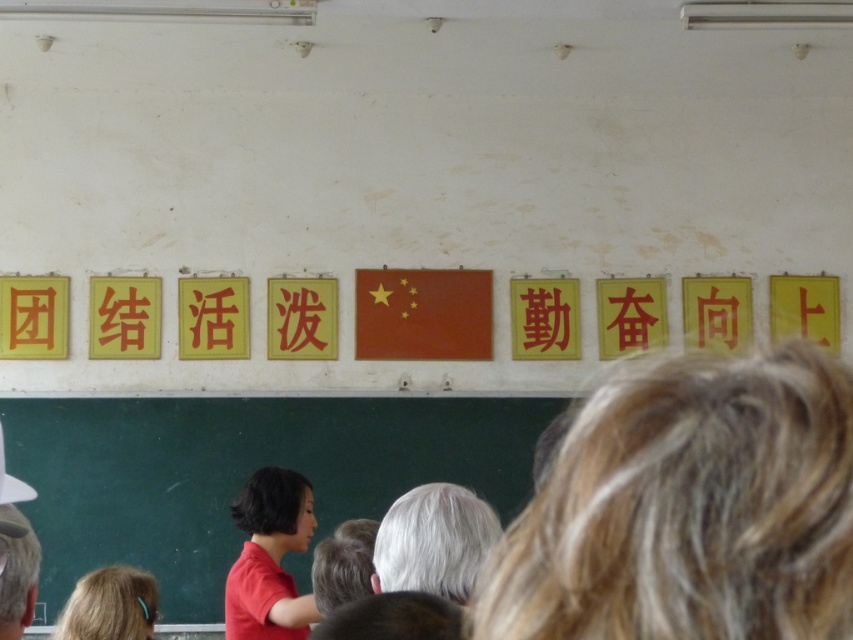
You are a photographer trying to capture a group photo of two people with different hair colors. You see a person with gray hair at center and another with blonde hair at lower left. Which person should you focus on first if you want to capture them from top to bottom?

The gray hair at center is located above the blonde hair at lower left, so you should focus on the gray hair at center first when capturing them from top to bottom.

You are a photographer trying to capture a group photo of two people with different hair colors. The scene has a gray hair at center and a blonde hair at lower left. Where should you position yourself to ensure both subjects are in frame and properly aligned with the wall decorations?

Position yourself to the left of the gray hair at center so that the gray hair at center is on the right side of the blonde hair at lower left, aligning both subjects with the central red flag and yellow signs on the wall.